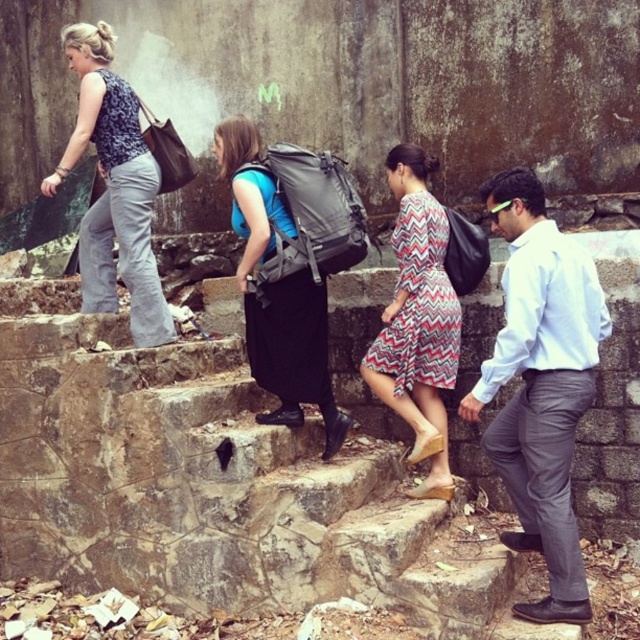
You are standing at the base of the stone steps and notice a point marked at coordinates (x=113, y=188). Which object in the scene is located at this point?

The point at (x=113, y=188) corresponds to the matte black top at left.

You are a delivery person holding a large package that measures 60 centimeters in length. You need to place it between the stone stairs at center and the matte gray backpack at center. Is there enough space to fit the package without it overlapping either object?

The distance between the stone stairs at center and the matte gray backpack at center is 61.39 centimeters. Since the package is 60 centimeters long, there is enough space to fit it between them without overlapping either object.

You are a photographer trying to capture a clear shot of the matte gray backpack at center and the black cotton dress at center from the bottom of the steps. Which object should you focus on first to ensure it appears larger in the photo?

The matte gray backpack at center is taller than the black cotton dress at center, so focusing on the matte gray backpack at center first will ensure it appears larger in the photo.